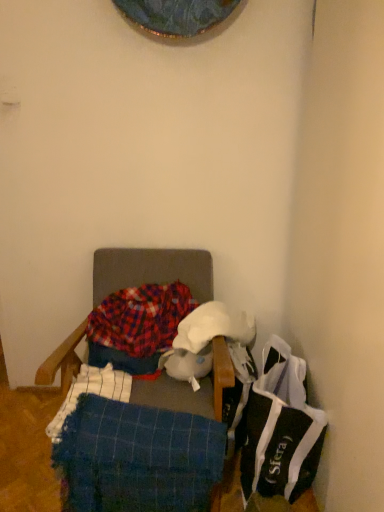
The width and height of the screenshot is (384, 512). Identify the location of blue woven blanket at lower left, arranged as the 2th blanket when viewed from the top. (137, 458).

Image resolution: width=384 pixels, height=512 pixels. What do you see at coordinates (140, 318) in the screenshot? I see `plaid fabric blanket at center, the 2th blanket when ordered from front to back` at bounding box center [140, 318].

What are the coordinates of `plaid fabric chair at center` in the screenshot? It's located at (152, 270).

Describe the element at coordinates (280, 428) in the screenshot. I see `black fabric bag at lower right` at that location.

Where is `blue woven blanket at lower left, which is the first blanket from bottom to top`? Image resolution: width=384 pixels, height=512 pixels. blue woven blanket at lower left, which is the first blanket from bottom to top is located at coordinates click(x=137, y=458).

Which object is more forward, blue woven blanket at lower left, positioned as the 2th blanket in back-to-front order, or black fabric bag at lower right?

Positioned in front is blue woven blanket at lower left, positioned as the 2th blanket in back-to-front order.

Looking at their sizes, would you say blue woven blanket at lower left, which is the first blanket from bottom to top, is wider or thinner than black fabric bag at lower right?

Considering their sizes, blue woven blanket at lower left, which is the first blanket from bottom to top, looks slimmer than black fabric bag at lower right.

Based on their positions, is plaid fabric blanket at center, which ranks as the 2th blanket in bottom-to-top order, located to the left or right of plaid fabric chair at center?

In the image, plaid fabric blanket at center, which ranks as the 2th blanket in bottom-to-top order, appears on the left side of plaid fabric chair at center.

Which is in front, plaid fabric blanket at center, which ranks as the 2th blanket in bottom-to-top order, or plaid fabric chair at center?

Positioned in front is plaid fabric chair at center.

Does plaid fabric blanket at center, the 1th blanket from the top, turn towards plaid fabric chair at center?

Yes, plaid fabric blanket at center, the 1th blanket from the top, is turned towards plaid fabric chair at center.

How different are the orientations of plaid fabric blanket at center, acting as the 1th blanket starting from the back, and plaid fabric chair at center in degrees?

The facing directions of plaid fabric blanket at center, acting as the 1th blanket starting from the back, and plaid fabric chair at center are 4.07 degrees apart.

Would you say blue woven blanket at lower left, positioned as the 1th blanket in front-to-back order, is inside or outside plaid fabric chair at center?

blue woven blanket at lower left, positioned as the 1th blanket in front-to-back order, fits inside plaid fabric chair at center.

At what (x,y) coordinates should I click in order to perform the action: click on blanket on the right side of plaid fabric chair at center. Please return your answer as a coordinate pair (x, y). Looking at the image, I should click on (137, 458).

Does blue woven blanket at lower left, positioned as the 1th blanket in front-to-back order, have a lesser height compared to plaid fabric chair at center?

Correct, blue woven blanket at lower left, positioned as the 1th blanket in front-to-back order, is not as tall as plaid fabric chair at center.

In the scene shown: Does blue woven blanket at lower left, arranged as the 2th blanket when viewed from the top, come behind plaid fabric chair at center?

No, blue woven blanket at lower left, arranged as the 2th blanket when viewed from the top, is closer to the viewer.

Which object is further away from the camera, plaid fabric chair at center or plaid fabric blanket at center, the 1th blanket from the top?

plaid fabric blanket at center, the 1th blanket from the top, is further away from the camera.

Consider the image. Is plaid fabric chair at center oriented away from plaid fabric blanket at center, which ranks as the 2th blanket in bottom-to-top order?

Yes, plaid fabric chair at center is positioned with its back facing plaid fabric blanket at center, which ranks as the 2th blanket in bottom-to-top order.

Is plaid fabric chair at center wider than plaid fabric blanket at center, which ranks as the 2th blanket in bottom-to-top order?

Indeed, plaid fabric chair at center has a greater width compared to plaid fabric blanket at center, which ranks as the 2th blanket in bottom-to-top order.

Where is `blanket behind the plaid fabric chair at center`? The width and height of the screenshot is (384, 512). blanket behind the plaid fabric chair at center is located at coordinates (140, 318).

Does black fabric bag at lower right have a lesser width compared to plaid fabric chair at center?

Correct, the width of black fabric bag at lower right is less than that of plaid fabric chair at center.

Is black fabric bag at lower right looking in the opposite direction of plaid fabric chair at center?

No, plaid fabric chair at center is not at the back of black fabric bag at lower right.

Is there a large distance between black fabric bag at lower right and plaid fabric chair at center?

That's not correct — black fabric bag at lower right is a little close to plaid fabric chair at center.

At what (x,y) coordinates should I click in order to perform the action: click on material below the plaid fabric chair at center (from the image's perspective). Please return your answer as a coordinate pair (x, y). Image resolution: width=384 pixels, height=512 pixels. Looking at the image, I should click on (280, 428).

Can you confirm if plaid fabric chair at center is smaller than blue woven blanket at lower left, positioned as the 1th blanket in front-to-back order?

Incorrect, plaid fabric chair at center is not smaller in size than blue woven blanket at lower left, positioned as the 1th blanket in front-to-back order.

Which object is further away from the camera taking this photo, plaid fabric chair at center or blue woven blanket at lower left, which is the first blanket from bottom to top?

plaid fabric chair at center is further from the camera.

Would you say plaid fabric chair at center is a long distance from blue woven blanket at lower left, positioned as the 2th blanket in back-to-front order?

plaid fabric chair at center is near blue woven blanket at lower left, positioned as the 2th blanket in back-to-front order, not far away.

Is plaid fabric chair at center outside of blue woven blanket at lower left, arranged as the 2th blanket when viewed from the top?

Yes, plaid fabric chair at center is not within blue woven blanket at lower left, arranged as the 2th blanket when viewed from the top.

Could you tell me if blue woven blanket at lower left, positioned as the 2th blanket in back-to-front order, is facing plaid fabric blanket at center, the 2th blanket when ordered from front to back?

No, blue woven blanket at lower left, positioned as the 2th blanket in back-to-front order, does not turn towards plaid fabric blanket at center, the 2th blanket when ordered from front to back.

Consider the image. From the image's perspective, is blue woven blanket at lower left, positioned as the 2th blanket in back-to-front order, located above or below plaid fabric blanket at center, the 2th blanket when ordered from front to back?

From the image's perspective, blue woven blanket at lower left, positioned as the 2th blanket in back-to-front order, appears below plaid fabric blanket at center, the 2th blanket when ordered from front to back.

Is blue woven blanket at lower left, positioned as the 1th blanket in front-to-back order, next to plaid fabric blanket at center, the 1th blanket from the top, and touching it?

There is a gap between blue woven blanket at lower left, positioned as the 1th blanket in front-to-back order, and plaid fabric blanket at center, the 1th blanket from the top.

Is blue woven blanket at lower left, positioned as the 1th blanket in front-to-back order, taller than plaid fabric blanket at center, which ranks as the 2th blanket in bottom-to-top order?

Indeed, blue woven blanket at lower left, positioned as the 1th blanket in front-to-back order, has a greater height compared to plaid fabric blanket at center, which ranks as the 2th blanket in bottom-to-top order.

I want to click on material below the blue woven blanket at lower left, which is the first blanket from bottom to top (from a real-world perspective), so click(x=280, y=428).

Find the location of `blanket above the plaid fabric chair at center (from the image's perspective)`. blanket above the plaid fabric chair at center (from the image's perspective) is located at coordinates (140, 318).

When comparing their distances from plaid fabric chair at center, does plaid fabric blanket at center, which ranks as the 2th blanket in bottom-to-top order, or black fabric bag at lower right seem closer?

Based on the image, plaid fabric blanket at center, which ranks as the 2th blanket in bottom-to-top order, appears to be nearer to plaid fabric chair at center.

When comparing their distances from black fabric bag at lower right, does blue woven blanket at lower left, positioned as the 2th blanket in back-to-front order, or plaid fabric blanket at center, the 2th blanket when ordered from front to back, seem further?

plaid fabric blanket at center, the 2th blanket when ordered from front to back, lies further to black fabric bag at lower right than the other object.

Based on their spatial positions, is plaid fabric chair at center or black fabric bag at lower right further from plaid fabric blanket at center, which ranks as the 2th blanket in bottom-to-top order?

black fabric bag at lower right is further to plaid fabric blanket at center, which ranks as the 2th blanket in bottom-to-top order.

Looking at this image, estimate the real-world distances between objects in this image. Which object is further from blue woven blanket at lower left, arranged as the 2th blanket when viewed from the top, plaid fabric chair at center or plaid fabric blanket at center, the 2th blanket when ordered from front to back?

plaid fabric blanket at center, the 2th blanket when ordered from front to back, lies further to blue woven blanket at lower left, arranged as the 2th blanket when viewed from the top, than the other object.

From the image, which object appears to be nearer to plaid fabric blanket at center, the 1th blanket from the top, blue woven blanket at lower left, positioned as the 2th blanket in back-to-front order, or plaid fabric chair at center?

plaid fabric chair at center is closer to plaid fabric blanket at center, the 1th blanket from the top.

Considering their positions, is plaid fabric blanket at center, the 1th blanket from the top, positioned further to blue woven blanket at lower left, positioned as the 2th blanket in back-to-front order, than plaid fabric chair at center?

plaid fabric blanket at center, the 1th blanket from the top, is further to blue woven blanket at lower left, positioned as the 2th blanket in back-to-front order.

Considering their positions, is plaid fabric chair at center positioned further to black fabric bag at lower right than blue woven blanket at lower left, positioned as the 1th blanket in front-to-back order?

plaid fabric chair at center is positioned further to the anchor black fabric bag at lower right.

From the image, which object appears to be farther from plaid fabric blanket at center, which ranks as the 2th blanket in bottom-to-top order, black fabric bag at lower right or blue woven blanket at lower left, positioned as the 1th blanket in front-to-back order?

The object further to plaid fabric blanket at center, which ranks as the 2th blanket in bottom-to-top order, is black fabric bag at lower right.

You are a GUI agent. You are given a task and a screenshot of the screen. Output one action in this format:
    pyautogui.click(x=<x>, y=<y>)
    Task: Click on the furniture between blue woven blanket at lower left, arranged as the 2th blanket when viewed from the top, and plaid fabric blanket at center, which ranks as the 2th blanket in bottom-to-top order, from front to back
    Image resolution: width=384 pixels, height=512 pixels.
    Given the screenshot: What is the action you would take?
    pyautogui.click(x=152, y=270)

Find the location of a particular element. blanket located between plaid fabric blanket at center, acting as the 1th blanket starting from the back, and black fabric bag at lower right in the left-right direction is located at coordinates (137, 458).

You are a GUI agent. You are given a task and a screenshot of the screen. Output one action in this format:
    pyautogui.click(x=<x>, y=<y>)
    Task: Click on the blanket between plaid fabric chair at center and black fabric bag at lower right from left to right
    This screenshot has width=384, height=512.
    Given the screenshot: What is the action you would take?
    pyautogui.click(x=137, y=458)

This screenshot has width=384, height=512. What are the coordinates of `furniture between plaid fabric blanket at center, the 1th blanket from the top, and black fabric bag at lower right from left to right` in the screenshot? It's located at 152,270.